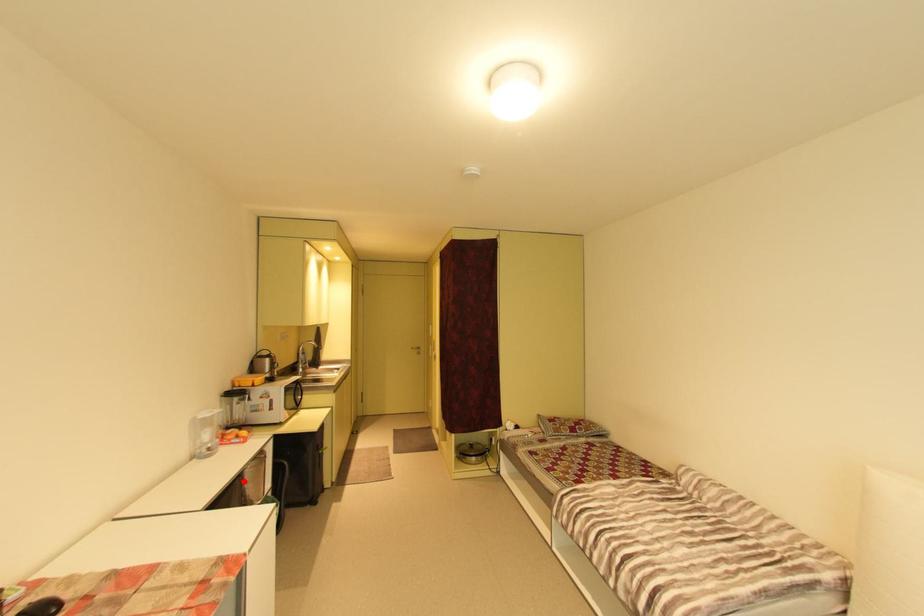
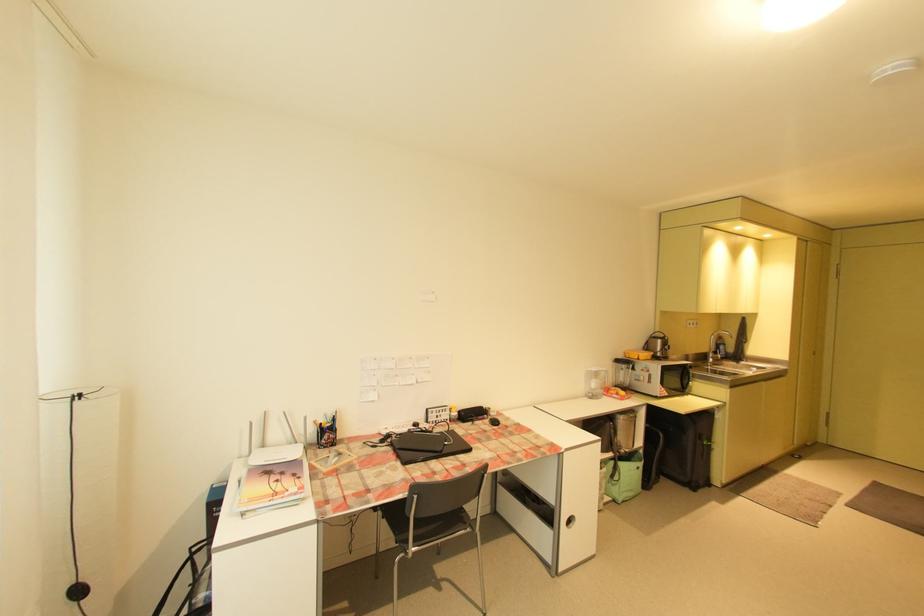
The point at the highlighted location is marked in the first image. Where is the corresponding point in the second image?

(614, 424)